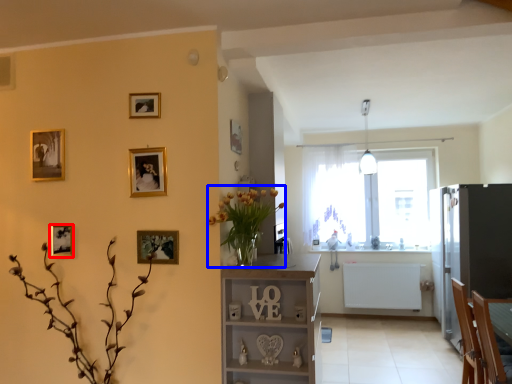
Question: Which of the following is the closest to the observer, picture frame (highlighted by a red box) or floral arrangement (highlighted by a blue box)?

Choices:
 (A) picture frame
 (B) floral arrangement

Answer: (B)